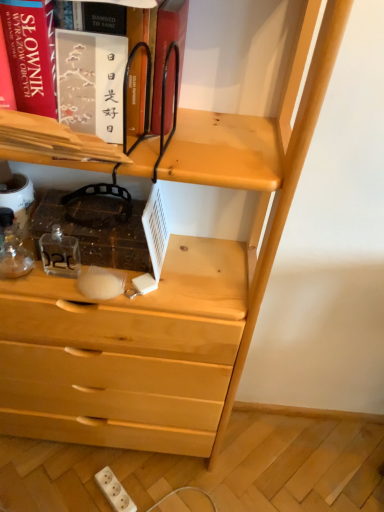
Question: Considering the relative sizes of white plastic electric outlet at lower center and matte black book at upper left in the image provided, is white plastic electric outlet at lower center taller than matte black book at upper left?

Choices:
 (A) no
 (B) yes

Answer: (A)

Question: Can you confirm if white plastic electric outlet at lower center is shorter than matte black book at upper left?

Choices:
 (A) yes
 (B) no

Answer: (A)

Question: Does white plastic electric outlet at lower center contain matte black book at upper left?

Choices:
 (A) no
 (B) yes

Answer: (A)

Question: From a real-world perspective, is white plastic electric outlet at lower center located beneath matte black book at upper left?

Choices:
 (A) yes
 (B) no

Answer: (A)

Question: Is white plastic electric outlet at lower center oriented towards matte black book at upper left?

Choices:
 (A) no
 (B) yes

Answer: (A)

Question: Is matte black book at upper left at the back of white plastic electric outlet at lower center?

Choices:
 (A) no
 (B) yes

Answer: (A)

Question: From a real-world perspective, is matte black book at upper left under white plastic electric outlet at lower center?

Choices:
 (A) yes
 (B) no

Answer: (B)

Question: Is matte black book at upper left to the right of white plastic electric outlet at lower center from the viewer's perspective?

Choices:
 (A) no
 (B) yes

Answer: (B)

Question: Is matte black book at upper left positioned before white plastic electric outlet at lower center?

Choices:
 (A) no
 (B) yes

Answer: (B)

Question: Is white plastic electric outlet at lower center completely or partially inside matte black book at upper left?

Choices:
 (A) no
 (B) yes

Answer: (A)

Question: Is the surface of matte black book at upper left in direct contact with white plastic electric outlet at lower center?

Choices:
 (A) no
 (B) yes

Answer: (A)

Question: Can you confirm if matte black book at upper left is shorter than white plastic electric outlet at lower center?

Choices:
 (A) yes
 (B) no

Answer: (B)

Question: From the image's perspective, is white plastic electric outlet at lower center above or below matte black book at upper left?

Choices:
 (A) below
 (B) above

Answer: (A)